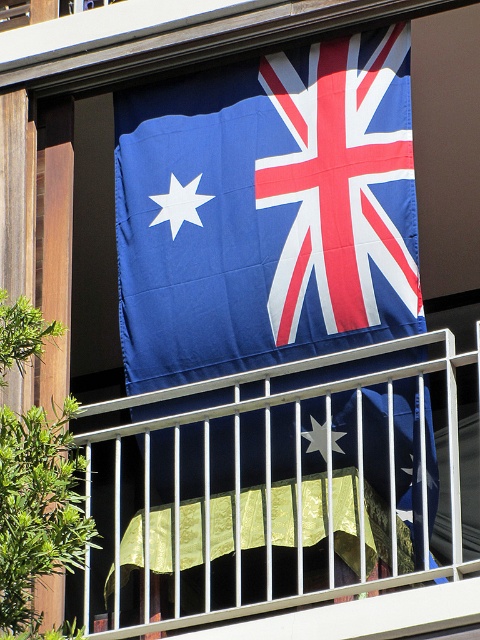
Question: Which point is farther to the camera?

Choices:
 (A) metallic silver balustrade at upper center
 (B) blue fabric flag at upper center

Answer: (B)

Question: In this image, where is blue fabric flag at upper center located relative to metallic silver balustrade at upper center?

Choices:
 (A) left
 (B) right

Answer: (A)

Question: Is blue fabric flag at upper center further to the viewer compared to metallic silver balustrade at upper center?

Choices:
 (A) yes
 (B) no

Answer: (A)

Question: Which point appears closest to the camera in this image?

Choices:
 (A) (208, 456)
 (B) (363, 268)

Answer: (A)

Question: Does blue fabric flag at upper center appear over metallic silver balustrade at upper center?

Choices:
 (A) no
 (B) yes

Answer: (B)